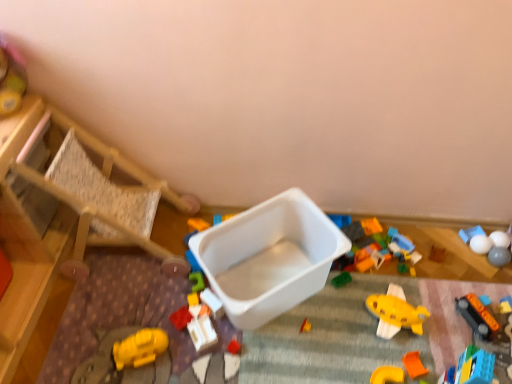
Locate an element on the screen. free space between orange matte plastic toy at lower right, the 10th toy viewed from the right, and white plastic container at center is located at coordinates (324, 344).